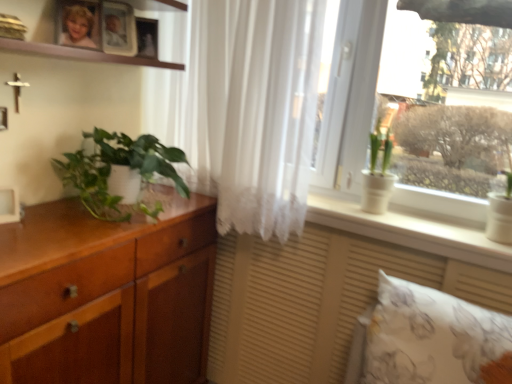
This screenshot has height=384, width=512. I want to click on free spot to the right of white matte picture frame at left, the 1th picture frame ordered from the bottom, so click(48, 222).